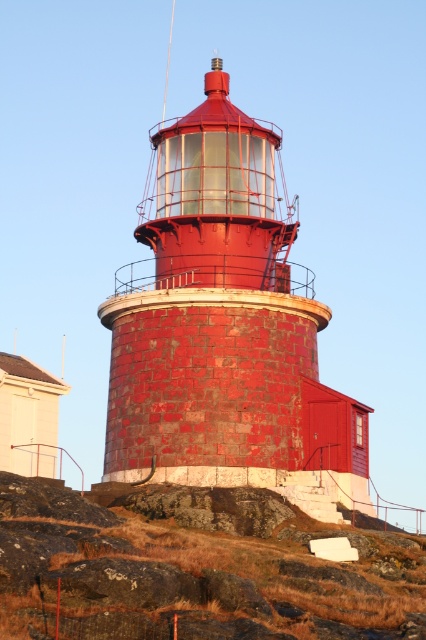
Consider the image. You are standing at the entrance of the lighthouse and want to reach the point marked as point (259, 241). Which direction should you move relative to point (29, 488)?

You should move behind point (29, 488) to reach point (259, 241) because point (259, 241) is behind point (29, 488).